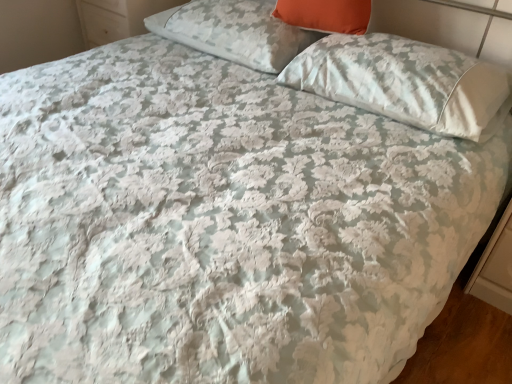
Question: Is white satin pillow at upper right, marked as the 1th pillow in a right-to-left arrangement, a part of white floral fabric pillow at upper center, marked as the third pillow in a right-to-left arrangement?

Choices:
 (A) yes
 (B) no

Answer: (B)

Question: From the image's perspective, is white floral fabric pillow at upper center, marked as the third pillow in a right-to-left arrangement, under white satin pillow at upper right, placed as the 3th pillow when sorted from left to right?

Choices:
 (A) yes
 (B) no

Answer: (B)

Question: Considering the relative sizes of white floral fabric pillow at upper center, marked as the third pillow in a right-to-left arrangement, and white satin pillow at upper right, placed as the 3th pillow when sorted from left to right, in the image provided, is white floral fabric pillow at upper center, marked as the third pillow in a right-to-left arrangement, taller than white satin pillow at upper right, placed as the 3th pillow when sorted from left to right,?

Choices:
 (A) no
 (B) yes

Answer: (B)

Question: Can you confirm if white floral fabric pillow at upper center, the first pillow when ordered from left to right, is positioned to the left of white satin pillow at upper right, marked as the 1th pillow in a right-to-left arrangement?

Choices:
 (A) no
 (B) yes

Answer: (B)

Question: Is white floral fabric pillow at upper center, the first pillow when ordered from left to right, smaller than white satin pillow at upper right, placed as the 3th pillow when sorted from left to right?

Choices:
 (A) yes
 (B) no

Answer: (A)

Question: From the image's perspective, is white satin pillow at upper right, placed as the 3th pillow when sorted from left to right, positioned above or below orange fabric pillow at upper center, acting as the 2th pillow starting from the left?

Choices:
 (A) above
 (B) below

Answer: (B)

Question: Looking at their shapes, would you say white satin pillow at upper right, placed as the 3th pillow when sorted from left to right, is wider or thinner than orange fabric pillow at upper center, acting as the 2th pillow starting from the right?

Choices:
 (A) wide
 (B) thin

Answer: (A)

Question: Looking at the image, does white satin pillow at upper right, marked as the 1th pillow in a right-to-left arrangement, seem bigger or smaller compared to orange fabric pillow at upper center, acting as the 2th pillow starting from the left?

Choices:
 (A) small
 (B) big

Answer: (B)

Question: Is point click(x=471, y=114) positioned closer to the camera than point click(x=287, y=1)?

Choices:
 (A) farther
 (B) closer

Answer: (B)

Question: From a real-world perspective, is white floral fabric pillow at upper center, the first pillow when ordered from left to right, physically located above or below white glossy dresser at upper left?

Choices:
 (A) above
 (B) below

Answer: (A)

Question: Considering the positions of point (211, 39) and point (90, 16), is point (211, 39) closer or farther from the camera than point (90, 16)?

Choices:
 (A) farther
 (B) closer

Answer: (B)

Question: In the image, is white floral fabric pillow at upper center, the first pillow when ordered from left to right, on the left side or the right side of white glossy dresser at upper left?

Choices:
 (A) right
 (B) left

Answer: (A)

Question: From the image's perspective, is white floral fabric pillow at upper center, the first pillow when ordered from left to right, positioned above or below white glossy dresser at upper left?

Choices:
 (A) above
 (B) below

Answer: (B)

Question: Is orange fabric pillow at upper center, acting as the 2th pillow starting from the left, in front of or behind white glossy dresser at upper left in the image?

Choices:
 (A) front
 (B) behind

Answer: (A)

Question: Considering the relative positions of orange fabric pillow at upper center, acting as the 2th pillow starting from the right, and white glossy dresser at upper left in the image provided, is orange fabric pillow at upper center, acting as the 2th pillow starting from the right, to the left or to the right of white glossy dresser at upper left?

Choices:
 (A) left
 (B) right

Answer: (B)